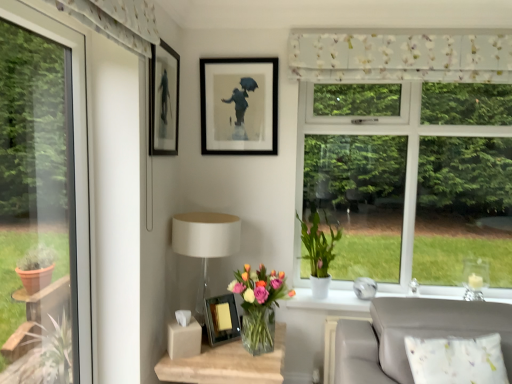
The width and height of the screenshot is (512, 384). Find the location of `vacant point above floral fabric curtain at upper center (from a real-world perspective)`. vacant point above floral fabric curtain at upper center (from a real-world perspective) is located at coordinates (404, 33).